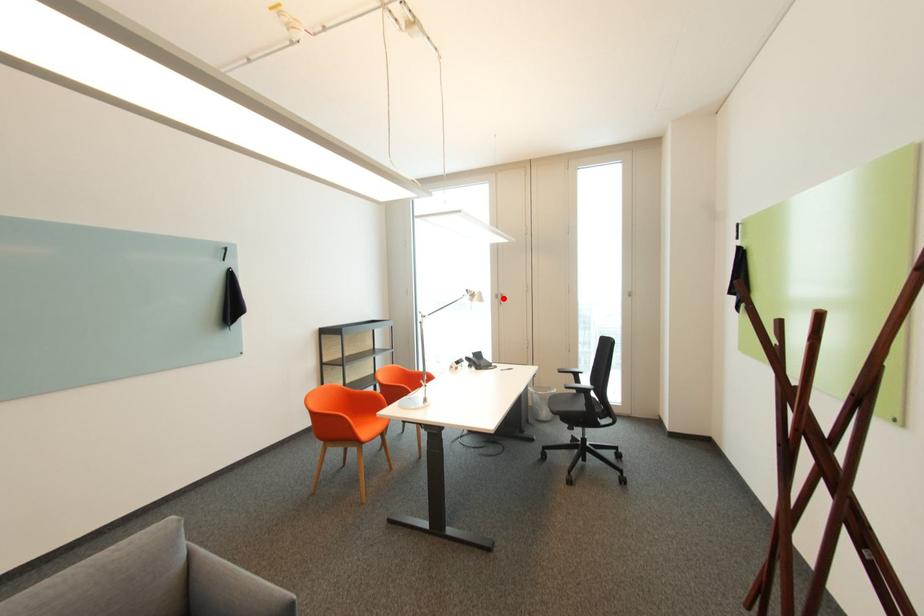
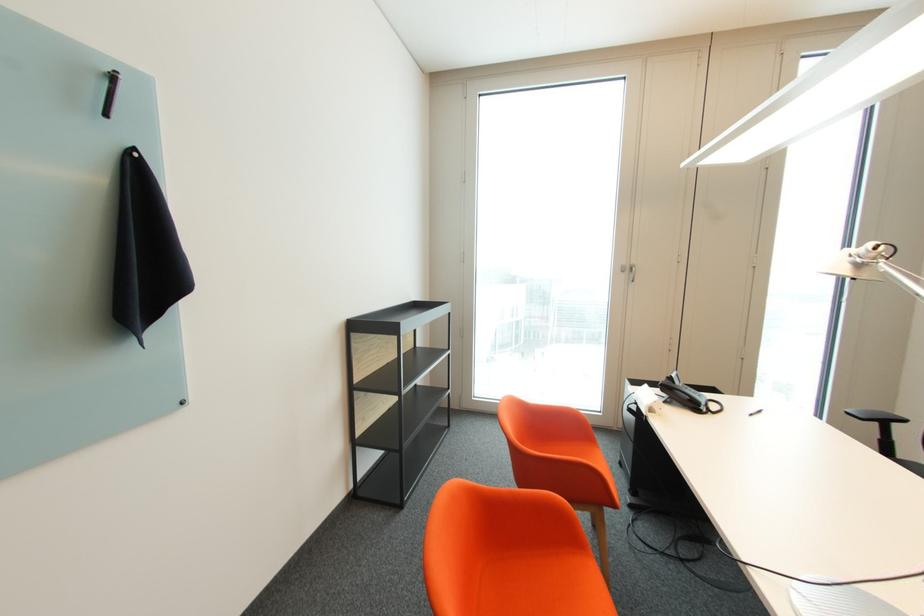
Where in the second image is the point corresponding to the highlighted location from the first image?

(629, 272)